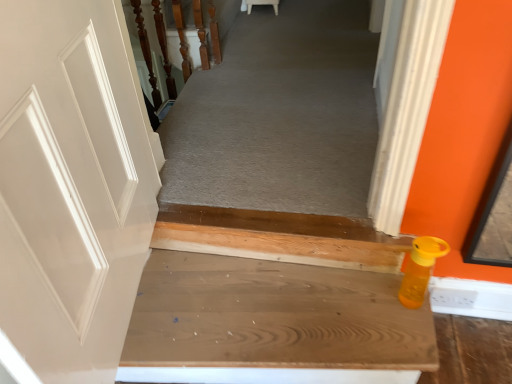
Question: Is orange matte bottle at lower right wider or thinner than wooden stairs at lower right?

Choices:
 (A) thin
 (B) wide

Answer: (A)

Question: Is orange matte bottle at lower right inside or outside of wooden stairs at lower right?

Choices:
 (A) outside
 (B) inside

Answer: (A)

Question: Which object is positioned farthest from the wooden stairs at lower right?

Choices:
 (A) wooden at upper left
 (B) orange matte bottle at lower right

Answer: (A)

Question: Which object is positioned closest to the orange matte bottle at lower right?

Choices:
 (A) wooden stairs at lower right
 (B) wooden at upper left

Answer: (A)